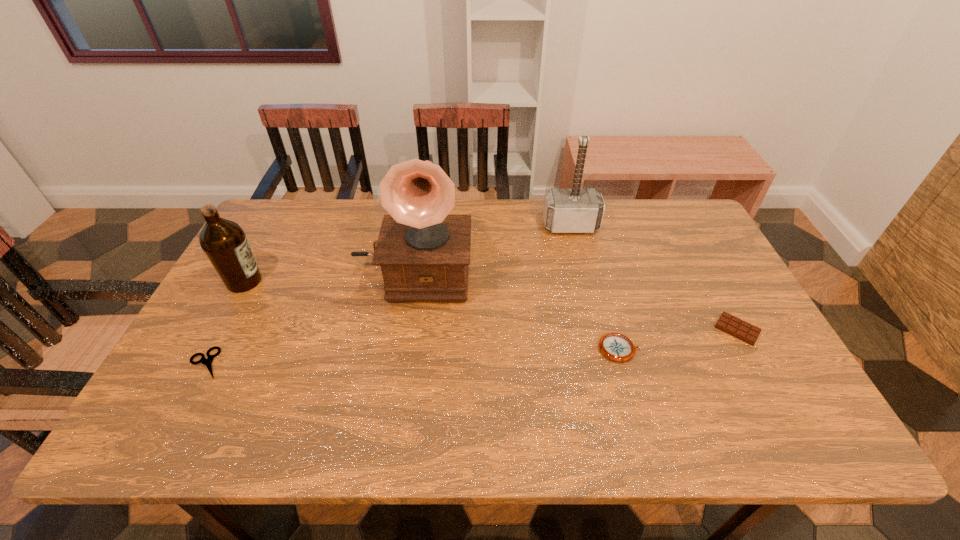
Locate an element on the screen. The image size is (960, 540). record player is located at coordinates (424, 252).

Find the location of a particular element. The height and width of the screenshot is (540, 960). the third object from left to right is located at coordinates (x=424, y=252).

Locate an element on the screen. the farthest object is located at coordinates (575, 210).

I want to click on hammer, so click(575, 210).

Locate an element on the screen. Image resolution: width=960 pixels, height=540 pixels. the third tallest object is located at coordinates (224, 242).

You are a GUI agent. You are given a task and a screenshot of the screen. Output one action in this format:
    pyautogui.click(x=<x>, y=<y>)
    Task: Click on the third shortest object
    This screenshot has height=540, width=960.
    Given the screenshot: What is the action you would take?
    [x=617, y=347]

This screenshot has height=540, width=960. Identify the location of the rightmost object. (736, 327).

Locate an element on the screen. the second shortest object is located at coordinates (736, 327).

This screenshot has height=540, width=960. I want to click on shears, so click(x=208, y=362).

Locate an element on the screen. The width and height of the screenshot is (960, 540). vacant space located 0.370m on the horn of the tallest object is located at coordinates (387, 439).